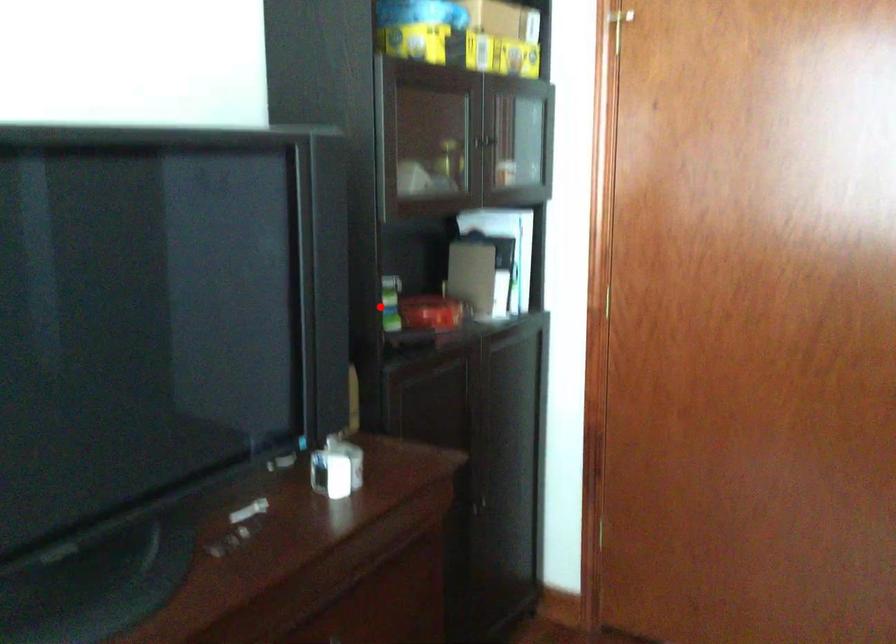
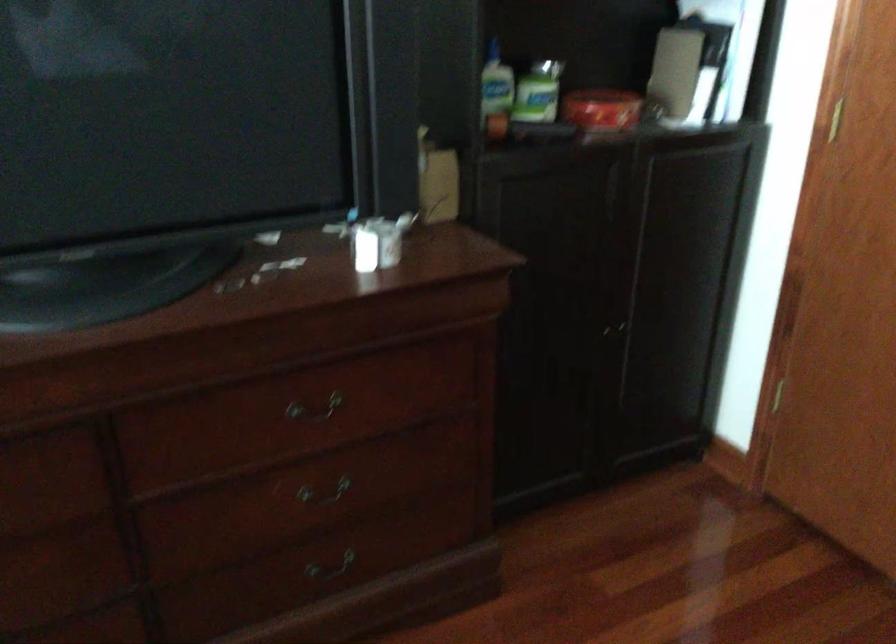
Where in the second image is the point corresponding to the highlighted location from the first image?

(538, 91)